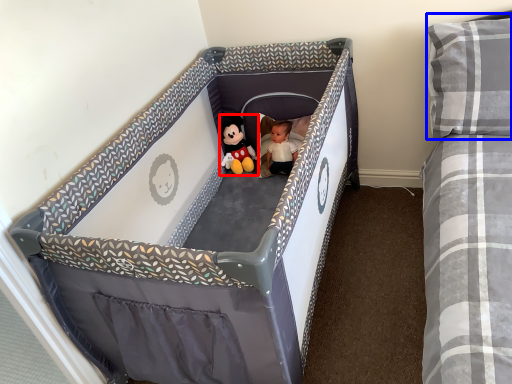
Question: Among these objects, which one is nearest to the camera, toy (highlighted by a red box) or pillow (highlighted by a blue box)?

Choices:
 (A) toy
 (B) pillow

Answer: (B)